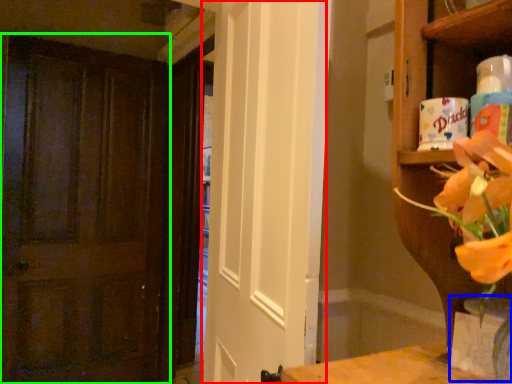
Question: Based on their relative distances, which object is nearer to screen door (highlighted by a red box)? Choose from vase (highlighted by a blue box) and door (highlighted by a green box).

Choices:
 (A) vase
 (B) door

Answer: (A)